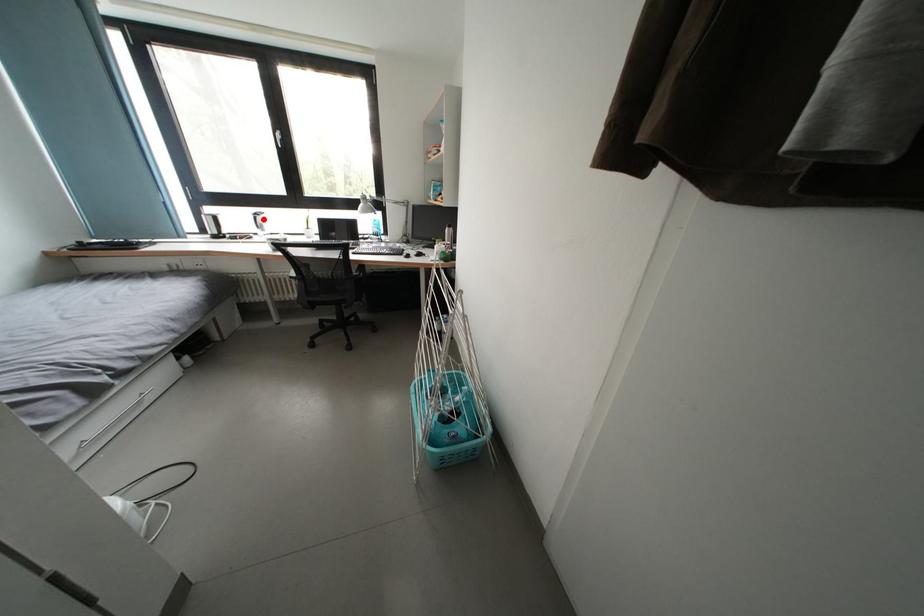
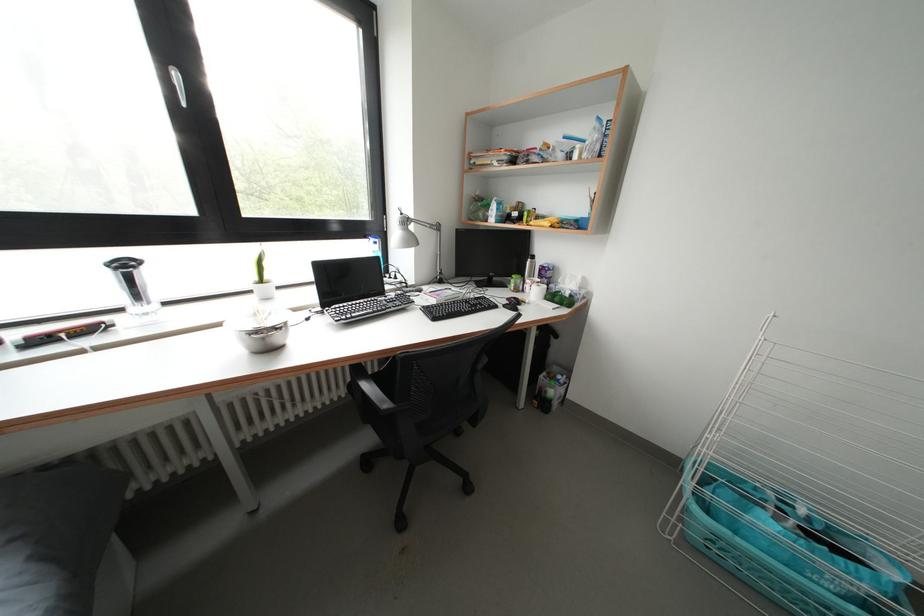
In the second image, find the point that corresponds to the highlighted location in the first image.

(131, 270)